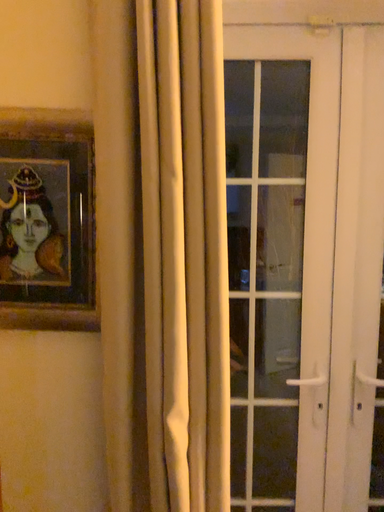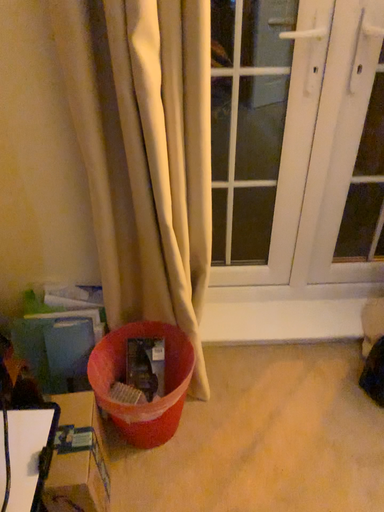
Question: Which way did the camera rotate in the video?

Choices:
 (A) rotated downward
 (B) rotated upward

Answer: (A)